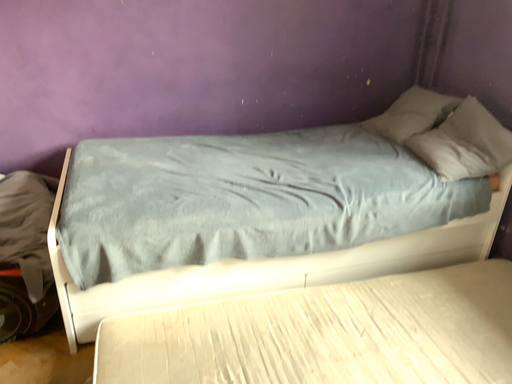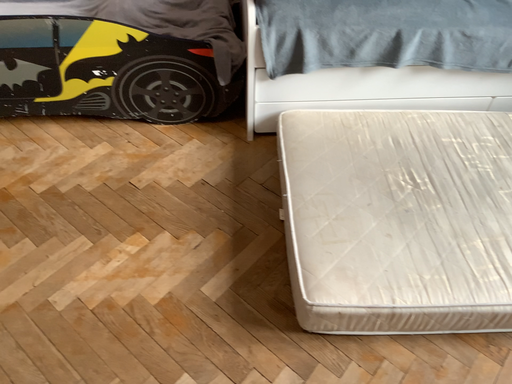
Question: Which way did the camera rotate in the video?

Choices:
 (A) rotated downward
 (B) rotated upward

Answer: (A)